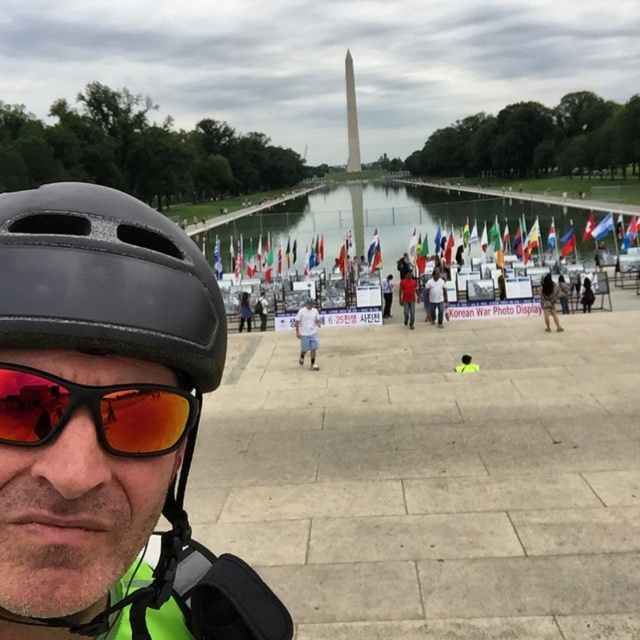
Which is behind, point (401, 282) or point (474, 371)?

The point (401, 282) is more distant.

Is point (410, 273) positioned after point (461, 356)?

Yes, it is.

This screenshot has height=640, width=640. In order to click on red fabric shirt at center in this screenshot , I will do `click(406, 298)`.

The image size is (640, 640). I want to click on red fabric shirt at center, so click(x=406, y=298).

Does brown fabric pants at center-right have a greater height compared to light blue shirt at center?

Indeed, brown fabric pants at center-right has a greater height compared to light blue shirt at center.

Does brown fabric pants at center-right appear over light blue shirt at center?

Correct, brown fabric pants at center-right is located above light blue shirt at center.

Who is more forward, (544, 321) or (262, 323)?

Positioned in front is point (544, 321).

Find the location of a particular element. This screenshot has width=640, height=640. brown fabric pants at center-right is located at coordinates (548, 301).

Can you confirm if red fabric shirt at center is taller than dark gray helmet at center?

Yes.

Who is more distant from viewer, (406,275) or (589,301)?

The point (589,301) is more distant.

Is point (401, 305) more distant than point (584, 296)?

No, it is in front of (584, 296).

At what (x,y) coordinates should I click in order to perform the action: click on red fabric shirt at center. Please return your answer as a coordinate pair (x, y). The height and width of the screenshot is (640, 640). Looking at the image, I should click on (406, 298).